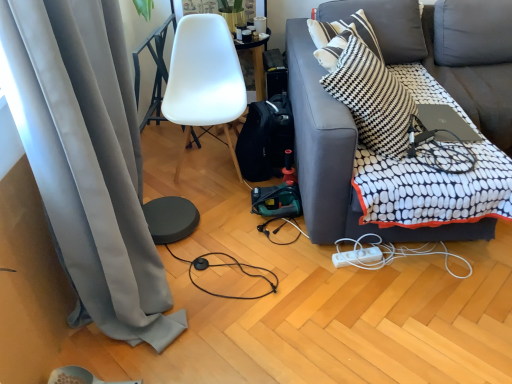
Where is `empty space that is to the right of gray fabric curtain at left`? empty space that is to the right of gray fabric curtain at left is located at coordinates (247, 334).